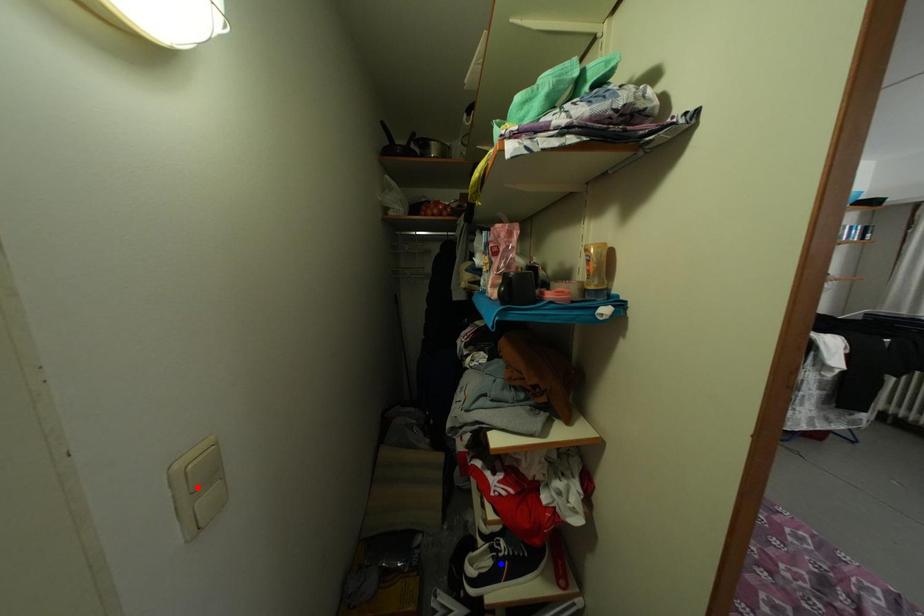
Question: Two points are marked on the image. Which point is closer to the camera?

Choices:
 (A) Blue point is closer.
 (B) Red point is closer.

Answer: (B)